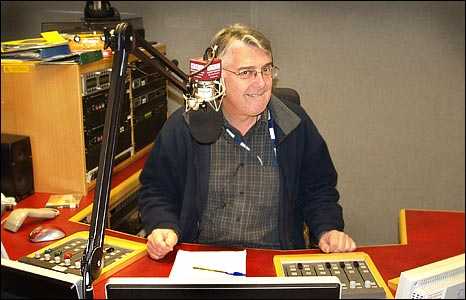
I want to click on computer mouse, so click(x=44, y=229).